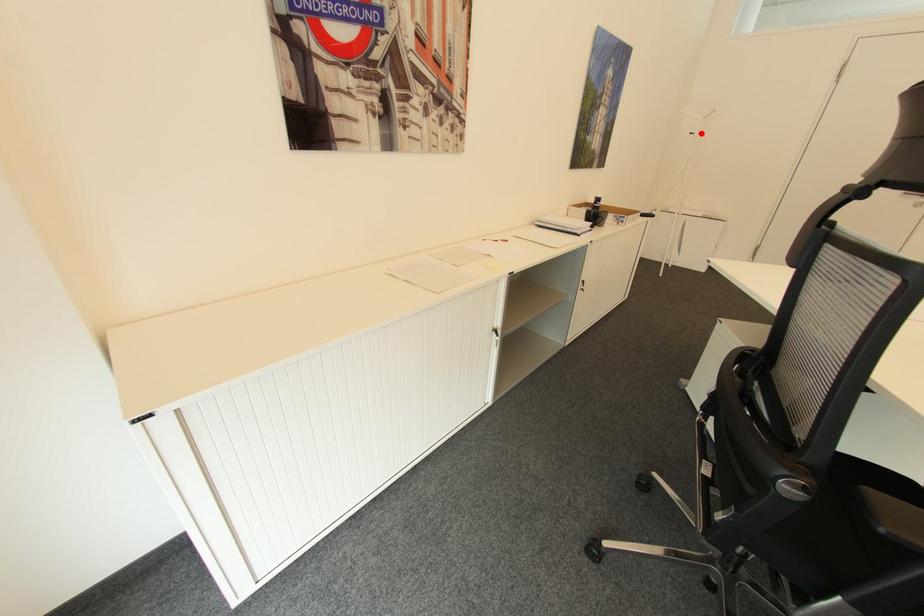
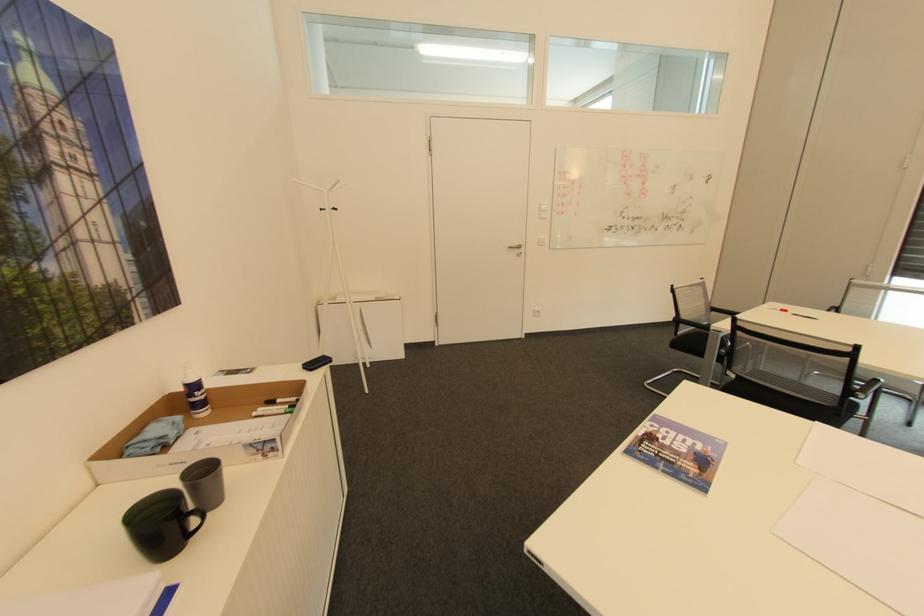
Where in the second image is the point corresponding to the highlighted location from the first image?

(333, 208)